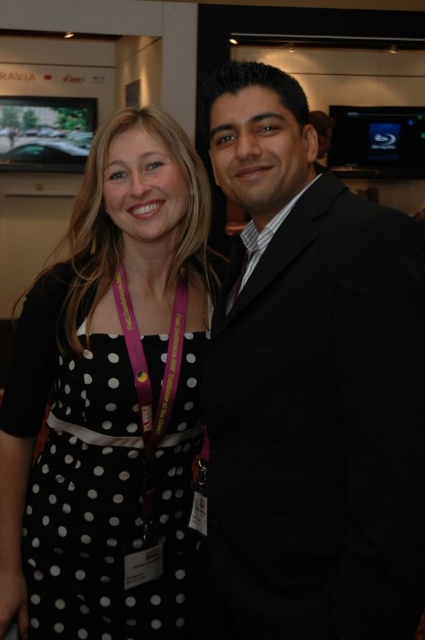
You are standing at the point marked by the coordinates point (280, 291) and want to greet the two people in the image. If you can only move forward in a straight line, will you reach the people before hitting any obstacles?

The distance between point (280, 291) and the viewer is 36.27 inches. Since there are no obstacles mentioned in the scene description, you can move forward in a straight line from point (280, 291) and reach the people without any issues.

You are at a conference and need to find the person wearing the black polka dot dress at center. Which direction should you look relative to the black suit at right?

The black polka dot dress at center is below the black suit at right, so you should look downward from the black suit at right to locate it.

You are at a conference and need to identify the clothing items worn by the attendees. Which item is placed above the other between the black polka dot dress at center and the pink fabric lanyard at center?

The black polka dot dress at center is positioned over the pink fabric lanyard at center, so the dress is above the lanyard.